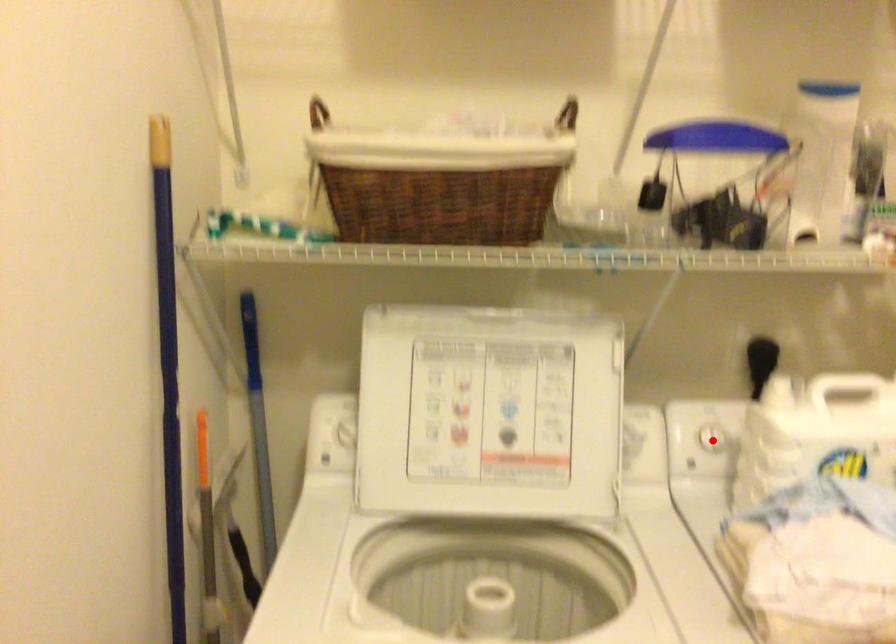
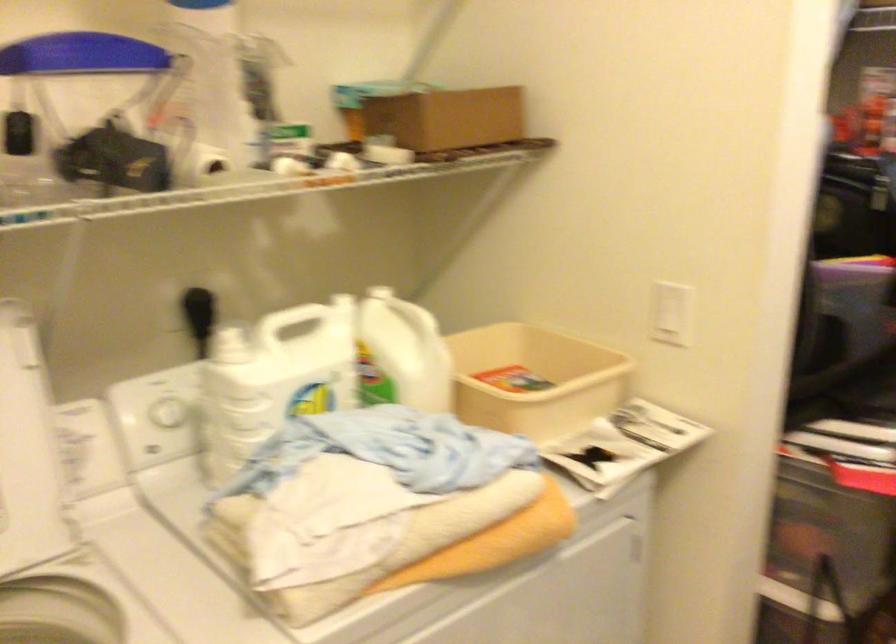
Where in the second image is the point corresponding to the highlighted location from the first image?

(168, 412)